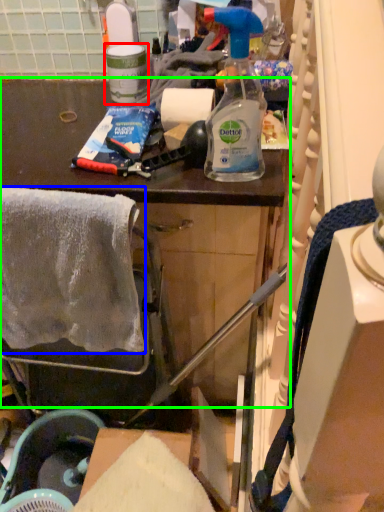
Question: Estimate the real-world distances between objects in this image. Which object is farther from bottle (highlighted by a red box), towel/napkin (highlighted by a blue box) or cabinetry (highlighted by a green box)?

Choices:
 (A) towel/napkin
 (B) cabinetry

Answer: (A)